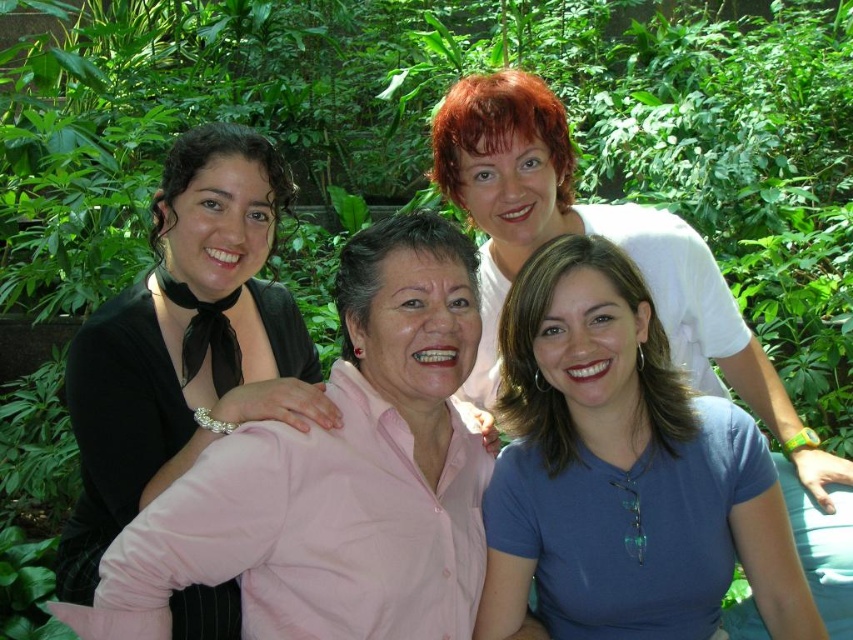
You are standing in a garden and see two women wearing the blue matte shirt at lower right and the black satin blouse at left. Which woman is positioned farther to the east?

The blue matte shirt at lower right is positioned farther to the east because it is to the right of the black satin blouse at left, and in the image, right corresponds to east.

In the scene described, there is a point located at coordinates [186,342]. Which object from the list of objects does this point correspond to?

The point at coordinates [186,342] corresponds to the black satin blouse at left.

You are a photographer trying to capture a group shot of the women in the scene. You need to ensure that the blue matte shirt at lower right and the white matte shirt at upper center are both in focus. Given that your camera has a depth of field that can cover 20 inches, will you be able to achieve this?

The distance between the blue matte shirt at lower right and the white matte shirt at upper center is 19.88 inches, which is within the camera depth of field of 20 inches. Therefore, both subjects can be in focus.